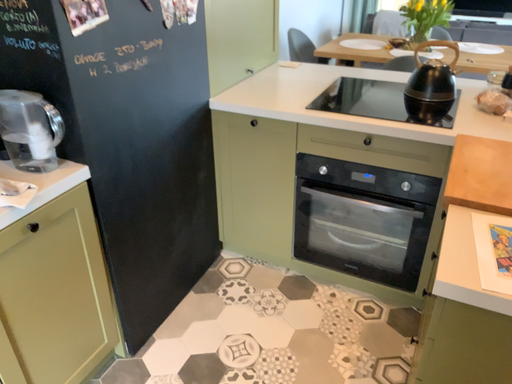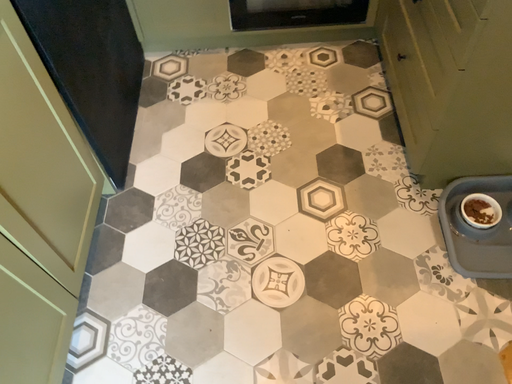
Question: Which way did the camera rotate in the video?

Choices:
 (A) rotated upward
 (B) rotated downward

Answer: (B)